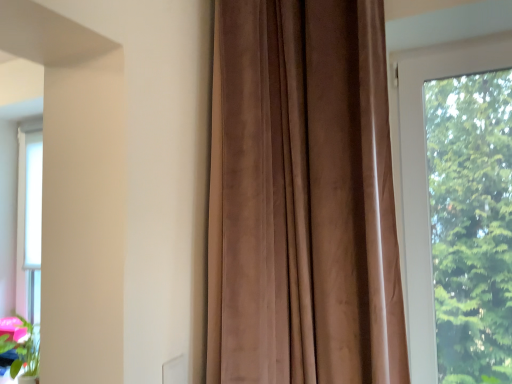
Question: Is transparent glass window at right far away from suede-like brown curtain at center?

Choices:
 (A) no
 (B) yes

Answer: (A)

Question: Is transparent glass window at right turned away from suede-like brown curtain at center?

Choices:
 (A) yes
 (B) no

Answer: (B)

Question: Is suede-like brown curtain at center completely or partially inside transparent glass window at right?

Choices:
 (A) yes
 (B) no

Answer: (B)

Question: Does transparent glass window at right have a lesser height compared to suede-like brown curtain at center?

Choices:
 (A) no
 (B) yes

Answer: (B)

Question: From a real-world perspective, is transparent glass window at right over suede-like brown curtain at center?

Choices:
 (A) yes
 (B) no

Answer: (B)

Question: Is transparent glass window at right bigger than suede-like brown curtain at center?

Choices:
 (A) no
 (B) yes

Answer: (A)

Question: Does suede-like brown curtain at center come in front of transparent glass window at right?

Choices:
 (A) no
 (B) yes

Answer: (B)

Question: Does suede-like brown curtain at center have a smaller size compared to transparent glass window at right?

Choices:
 (A) yes
 (B) no

Answer: (B)

Question: From the image's perspective, would you say suede-like brown curtain at center is positioned over transparent glass window at right?

Choices:
 (A) yes
 (B) no

Answer: (A)

Question: Can you confirm if suede-like brown curtain at center is positioned to the left of transparent glass window at right?

Choices:
 (A) yes
 (B) no

Answer: (A)

Question: Considering the relative sizes of suede-like brown curtain at center and transparent glass window at right in the image provided, is suede-like brown curtain at center bigger than transparent glass window at right?

Choices:
 (A) no
 (B) yes

Answer: (B)

Question: Does suede-like brown curtain at center have a greater width compared to transparent glass window at right?

Choices:
 (A) yes
 (B) no

Answer: (A)

Question: Considering the positions of suede-like brown curtain at center and transparent glass window at right in the image, is suede-like brown curtain at center bigger or smaller than transparent glass window at right?

Choices:
 (A) big
 (B) small

Answer: (A)